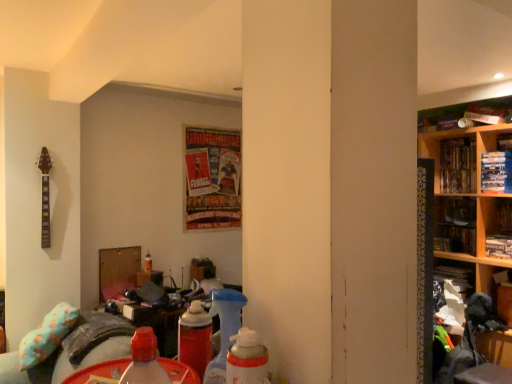
Question: Is the depth of fluffy teal pillow at lower left less than that of translucent plastic bottle at center, arranged as the 2th bottle when viewed from the front?

Choices:
 (A) no
 (B) yes

Answer: (B)

Question: From a real-world perspective, is fluffy teal pillow at lower left under translucent plastic bottle at center, which is the 2th bottle in top-to-bottom order?

Choices:
 (A) no
 (B) yes

Answer: (B)

Question: Is the surface of fluffy teal pillow at lower left in direct contact with translucent plastic bottle at center, which is counted as the 1th bottle, starting from the bottom?

Choices:
 (A) no
 (B) yes

Answer: (A)

Question: Considering the relative sizes of fluffy teal pillow at lower left and translucent plastic bottle at center, which is the 2th bottle from right to left, in the image provided, is fluffy teal pillow at lower left taller than translucent plastic bottle at center, which is the 2th bottle from right to left,?

Choices:
 (A) no
 (B) yes

Answer: (B)

Question: Is fluffy teal pillow at lower left further to camera compared to translucent plastic bottle at center, which is the 2th bottle in top-to-bottom order?

Choices:
 (A) no
 (B) yes

Answer: (A)

Question: From a real-world perspective, relative to fluffy teal pillow at lower left, is wooden shelves at right vertically above or below?

Choices:
 (A) above
 (B) below

Answer: (A)

Question: From the image's perspective, is wooden shelves at right above or below fluffy teal pillow at lower left?

Choices:
 (A) above
 (B) below

Answer: (A)

Question: Would you say wooden shelves at right is to the left or to the right of fluffy teal pillow at lower left in the picture?

Choices:
 (A) right
 (B) left

Answer: (A)

Question: Is wooden shelves at right in front of or behind fluffy teal pillow at lower left in the image?

Choices:
 (A) behind
 (B) front

Answer: (A)

Question: Is hardcover books at upper right, arranged as the 2th book when viewed from the right, wider or thinner than shiny paper poster at center, which ranks as the fifth book in right-to-left order?

Choices:
 (A) thin
 (B) wide

Answer: (B)

Question: Considering the relative positions of hardcover books at upper right, arranged as the 2th book when viewed from the right, and shiny paper poster at center, positioned as the first book in left-to-right order, in the image provided, is hardcover books at upper right, arranged as the 2th book when viewed from the right, to the left or to the right of shiny paper poster at center, positioned as the first book in left-to-right order,?

Choices:
 (A) left
 (B) right

Answer: (B)

Question: In the image, is hardcover books at upper right, the 4th book from the left, positioned in front of or behind shiny paper poster at center, positioned as the first book in left-to-right order?

Choices:
 (A) front
 (B) behind

Answer: (A)

Question: From a real-world perspective, is hardcover books at upper right, the 4th book from the left, above or below shiny paper poster at center, which ranks as the fifth book in right-to-left order?

Choices:
 (A) below
 (B) above

Answer: (B)

Question: In the image, is wooden shelves at right positioned in front of or behind translucent plastic bottle at center, arranged as the 2th bottle when viewed from the front?

Choices:
 (A) front
 (B) behind

Answer: (A)

Question: Considering the positions of wooden shelves at right and translucent plastic bottle at center, which is counted as the 1th bottle, starting from the bottom, in the image, is wooden shelves at right wider or thinner than translucent plastic bottle at center, which is counted as the 1th bottle, starting from the bottom,?

Choices:
 (A) thin
 (B) wide

Answer: (B)